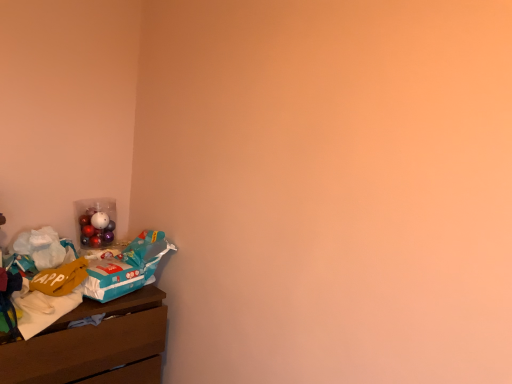
The height and width of the screenshot is (384, 512). In order to click on brown wooden chest of drawers at lower left in this screenshot , I will do `click(94, 345)`.

What do you see at coordinates (94, 345) in the screenshot? I see `brown wooden chest of drawers at lower left` at bounding box center [94, 345].

Locate an element on the screen. The width and height of the screenshot is (512, 384). brown wooden chest of drawers at lower left is located at coordinates (94, 345).